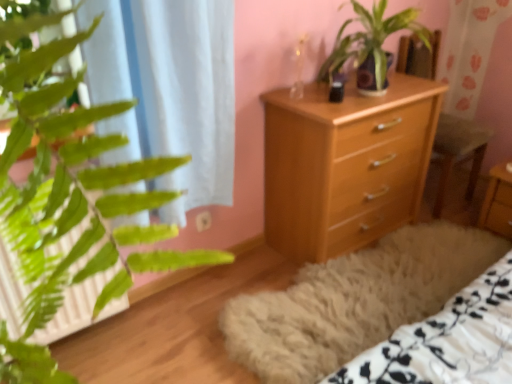
Question: Does wooden armchair at center appear on the left side of green leafy plant at center?

Choices:
 (A) no
 (B) yes

Answer: (A)

Question: From a real-world perspective, is wooden armchair at center positioned under green leafy plant at center based on gravity?

Choices:
 (A) no
 (B) yes

Answer: (B)

Question: Considering the relative positions of wooden armchair at center and green leafy plant at center in the image provided, is wooden armchair at center to the right of green leafy plant at center from the viewer's perspective?

Choices:
 (A) no
 (B) yes

Answer: (B)

Question: Is wooden armchair at center completely or partially outside of green leafy plant at center?

Choices:
 (A) yes
 (B) no

Answer: (A)

Question: Are wooden armchair at center and green leafy plant at center far apart?

Choices:
 (A) no
 (B) yes

Answer: (A)

Question: Considering the positions of green leafy plant at center and wooden armchair at center in the image, is green leafy plant at center wider or thinner than wooden armchair at center?

Choices:
 (A) wide
 (B) thin

Answer: (B)

Question: Looking at the image, does green leafy plant at center seem bigger or smaller compared to wooden armchair at center?

Choices:
 (A) small
 (B) big

Answer: (A)

Question: From the image's perspective, is green leafy plant at center located above or below wooden armchair at center?

Choices:
 (A) below
 (B) above

Answer: (B)

Question: From a real-world perspective, is green leafy plant at center physically located above or below wooden armchair at center?

Choices:
 (A) below
 (B) above

Answer: (B)

Question: Looking at the image, does green leafy plant at center seem bigger or smaller compared to light wood chest of drawers at center?

Choices:
 (A) small
 (B) big

Answer: (A)

Question: Considering the positions of green leafy plant at center and light wood chest of drawers at center in the image, is green leafy plant at center taller or shorter than light wood chest of drawers at center?

Choices:
 (A) tall
 (B) short

Answer: (B)

Question: From a real-world perspective, is green leafy plant at center positioned above or below light wood chest of drawers at center?

Choices:
 (A) below
 (B) above

Answer: (B)

Question: Considering the relative positions of green leafy plant at center and light wood chest of drawers at center in the image provided, is green leafy plant at center to the left or to the right of light wood chest of drawers at center?

Choices:
 (A) right
 (B) left

Answer: (A)

Question: Looking at their shapes, would you say light wood chest of drawers at center is wider or thinner than wooden armchair at center?

Choices:
 (A) thin
 (B) wide

Answer: (A)

Question: Do you think light wood chest of drawers at center is within wooden armchair at center, or outside of it?

Choices:
 (A) inside
 (B) outside

Answer: (B)